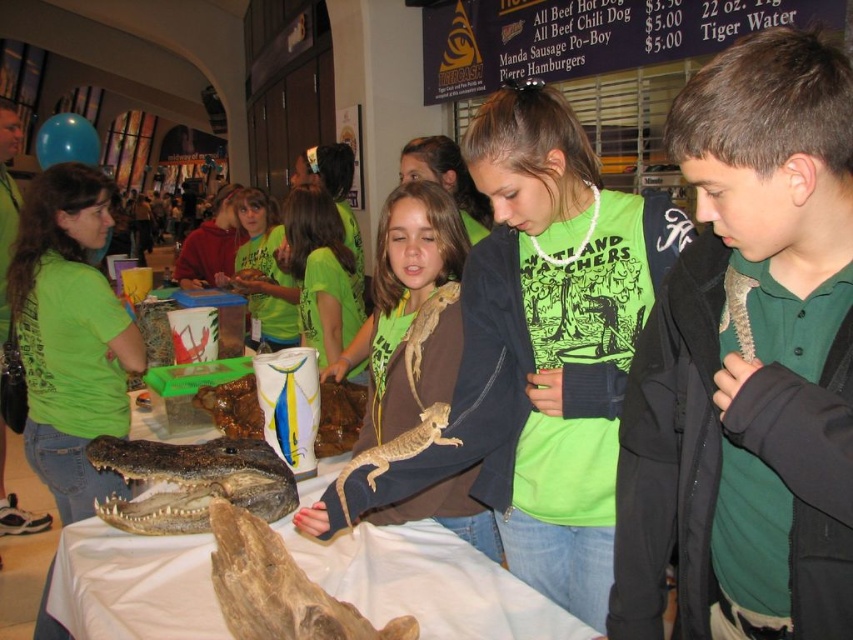
You are a photographer trying to capture a clear photo of the dark brown textured crocodile head at center. However, the green textured shirt at center is blocking your view. Can you move the shirt to get a better shot?

The green textured shirt at center is in front of the dark brown textured crocodile head at center, so moving the shirt would allow you to see the crocodile head clearly.

From the picture: You are standing in the reptile event area and want to move from point A to point B. Point A is at coordinate point (123, 515) and point B is at coordinate point (440, 416). Which point is closer to you, point A or point B?

Point A at coordinate point (123, 515) is closer to you because it is further to the viewer than point B at coordinate point (440, 416).

What is the object located at the coordinates point (192, 481) in the image?

The object at point (192, 481) is the dark brown textured crocodile head at center.